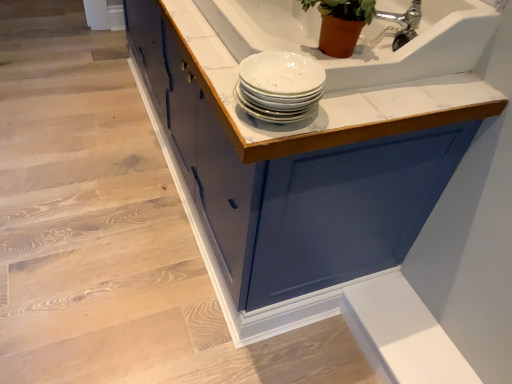
Question: Can you confirm if white glossy plates at upper center is shorter than silver metallic faucet at upper right?

Choices:
 (A) yes
 (B) no

Answer: (A)

Question: Could silver metallic faucet at upper right be considered to be inside white glossy plates at upper center?

Choices:
 (A) no
 (B) yes

Answer: (A)

Question: Does white glossy plates at upper center have a greater width compared to silver metallic faucet at upper right?

Choices:
 (A) yes
 (B) no

Answer: (A)

Question: Is white glossy plates at upper center at the left side of silver metallic faucet at upper right?

Choices:
 (A) yes
 (B) no

Answer: (A)

Question: Is white glossy plates at upper center positioned in front of silver metallic faucet at upper right?

Choices:
 (A) yes
 (B) no

Answer: (A)

Question: Would you say white glossy plates at upper center is inside or outside white glossy countertop at upper center?

Choices:
 (A) outside
 (B) inside

Answer: (A)

Question: From their relative heights in the image, would you say white glossy plates at upper center is taller or shorter than white glossy countertop at upper center?

Choices:
 (A) tall
 (B) short

Answer: (B)

Question: In the image, is white glossy plates at upper center on the left side or the right side of white glossy countertop at upper center?

Choices:
 (A) right
 (B) left

Answer: (B)

Question: Is point (261, 84) closer or farther from the camera than point (190, 52)?

Choices:
 (A) farther
 (B) closer

Answer: (B)

Question: Is silver metallic faucet at upper right bigger or smaller than white glossy countertop at upper center?

Choices:
 (A) big
 (B) small

Answer: (B)

Question: In the image, is silver metallic faucet at upper right on the left side or the right side of white glossy countertop at upper center?

Choices:
 (A) left
 (B) right

Answer: (B)

Question: Does point (402, 39) appear closer or farther from the camera than point (389, 99)?

Choices:
 (A) closer
 (B) farther

Answer: (B)

Question: Is silver metallic faucet at upper right taller or shorter than white glossy countertop at upper center?

Choices:
 (A) tall
 (B) short

Answer: (B)

Question: Is point (263, 337) closer or farther from the camera than point (162, 13)?

Choices:
 (A) farther
 (B) closer

Answer: (B)

Question: In the image, is matte blue cabinet at upper center on the left side or the right side of white glossy countertop at upper center?

Choices:
 (A) left
 (B) right

Answer: (A)